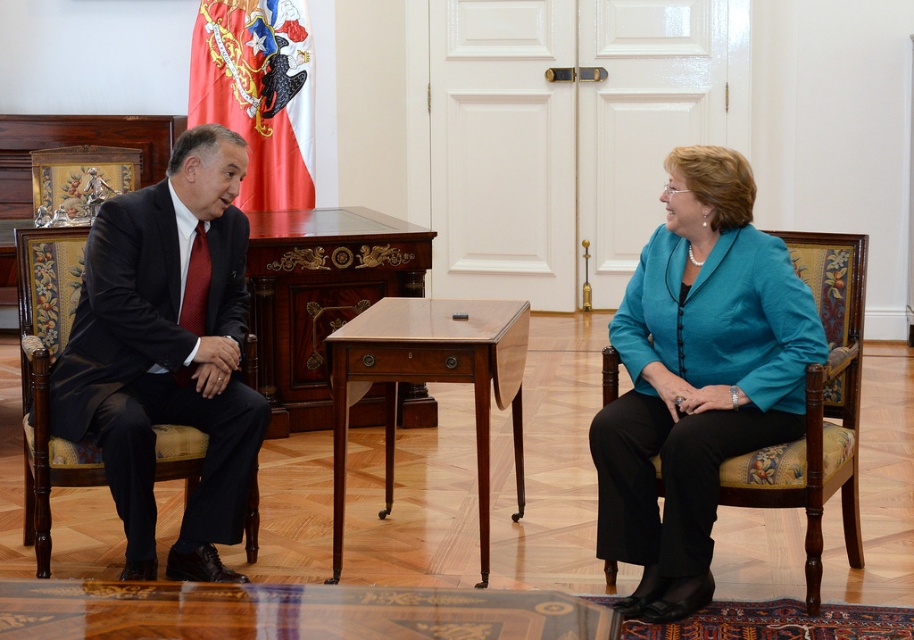
Question: Which point appears farthest from the camera in this image?

Choices:
 (A) (211, 536)
 (B) (337, 579)

Answer: (B)

Question: Is matte black suit at left further to the viewer compared to mahogany wood table at center?

Choices:
 (A) no
 (B) yes

Answer: (A)

Question: Which point is farther from the camera taking this photo?

Choices:
 (A) (129, 262)
 (B) (359, 314)
 (C) (635, 276)

Answer: (B)

Question: Does matte black suit at left lie behind mahogany wood table at center?

Choices:
 (A) no
 (B) yes

Answer: (A)

Question: Does teal fabric jacket at center come in front of mahogany wood table at center?

Choices:
 (A) yes
 (B) no

Answer: (A)

Question: Which point appears closest to the camera in this image?

Choices:
 (A) (231, 468)
 (B) (736, 284)

Answer: (B)